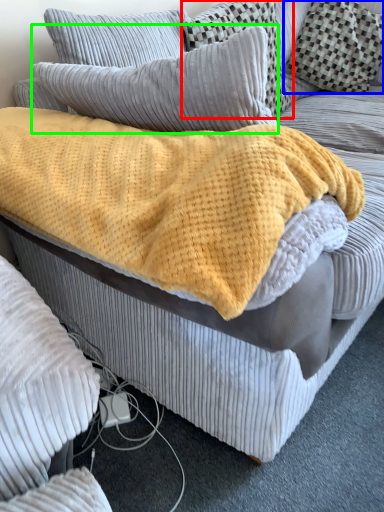
Question: Considering the real-world distances, which object is closest to pillow (highlighted by a red box)? pillow (highlighted by a blue box) or pillow (highlighted by a green box).

Choices:
 (A) pillow
 (B) pillow

Answer: (A)